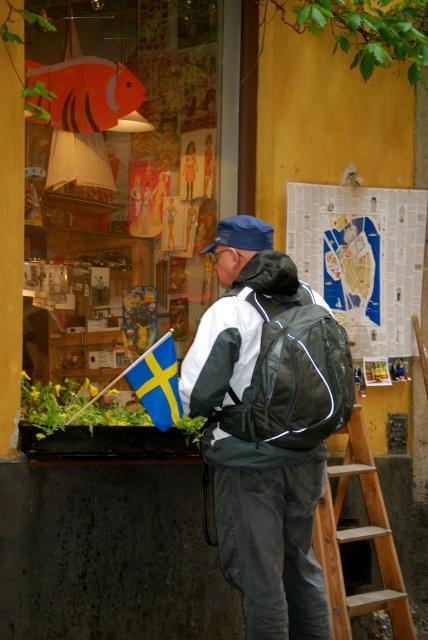
Which is below, orange matte fish at upper left or blue fabric flag at lower left?

Positioned lower is blue fabric flag at lower left.

Is orange matte fish at upper left to the left of blue fabric flag at lower left from the viewer's perspective?

Yes, orange matte fish at upper left is to the left of blue fabric flag at lower left.

Between point (109, 64) and point (166, 372), which one is positioned behind?

Point (109, 64)

Identify the location of orange matte fish at upper left. (86, 92).

Between matte black backpack at center and orange matte fish at upper left, which one is positioned lower?

Positioned lower is matte black backpack at center.

Between point (270, 408) and point (65, 93), which one is positioned in front?

Point (270, 408) is more forward.

Which is in front, point (291, 307) or point (68, 104)?

Positioned in front is point (291, 307).

Locate an element on the screen. matte black backpack at center is located at coordinates (269, 433).

Which is more to the right, white matte jacket at center or blue fabric flag at lower left?

From the viewer's perspective, white matte jacket at center appears more on the right side.

Is white matte jacket at center positioned before blue fabric flag at lower left?

Yes, it is in front of blue fabric flag at lower left.

Which is in front, point (241, 396) or point (160, 401)?

Positioned in front is point (241, 396).

This screenshot has height=640, width=428. I want to click on white matte jacket at center, so click(x=232, y=336).